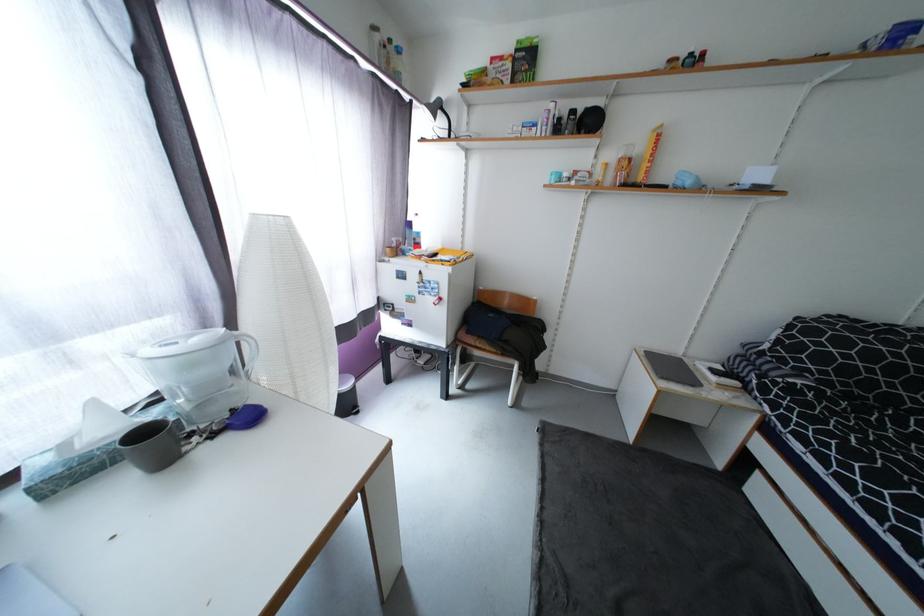
I want to click on chair sitting surface, so click(x=492, y=342).